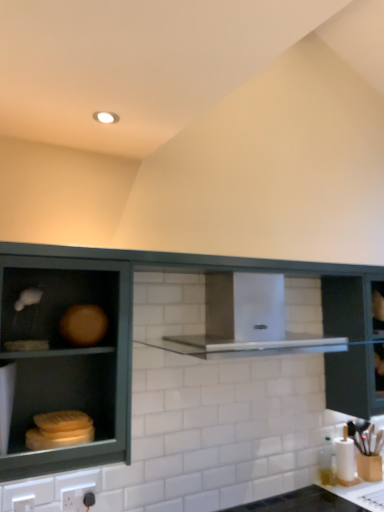
Question: Is transparent glass cabinet at right to the right of black plastic electric outlet at lower center, placed as the 1th electric outlet when sorted from back to front, from the viewer's perspective?

Choices:
 (A) no
 (B) yes

Answer: (B)

Question: Is transparent glass cabinet at right touching black plastic electric outlet at lower center, arranged as the 2th electric outlet when viewed from the left?

Choices:
 (A) no
 (B) yes

Answer: (A)

Question: Is transparent glass cabinet at right behind black plastic electric outlet at lower center, placed as the 1th electric outlet when sorted from back to front?

Choices:
 (A) yes
 (B) no

Answer: (A)

Question: Is black plastic electric outlet at lower center, arranged as the 2th electric outlet when viewed from the left, a part of transparent glass cabinet at right?

Choices:
 (A) no
 (B) yes

Answer: (A)

Question: Is transparent glass cabinet at right positioned far away from black plastic electric outlet at lower center, arranged as the 2th electric outlet when viewed from the left?

Choices:
 (A) yes
 (B) no

Answer: (A)

Question: Is point (309, 484) closer or farther from the camera than point (26, 397)?

Choices:
 (A) closer
 (B) farther

Answer: (B)

Question: In the image, is black glossy countertop at lower right positioned in front of or behind green matte cabinet at left, which ranks as the 1th cabinetry in back-to-front order?

Choices:
 (A) front
 (B) behind

Answer: (B)

Question: Looking at their shapes, would you say black glossy countertop at lower right is wider or thinner than green matte cabinet at left, which ranks as the 1th cabinetry in back-to-front order?

Choices:
 (A) wide
 (B) thin

Answer: (A)

Question: Is black glossy countertop at lower right taller or shorter than green matte cabinet at left, positioned as the second cabinetry in front-to-back order?

Choices:
 (A) short
 (B) tall

Answer: (A)

Question: In terms of width, does green matte cabinet at left, positioned as the second cabinetry in front-to-back order, look wider or thinner when compared to black glossy countertop at lower right?

Choices:
 (A) wide
 (B) thin

Answer: (B)

Question: Is green matte cabinet at left, positioned as the second cabinetry in front-to-back order, inside the boundaries of black glossy countertop at lower right, or outside?

Choices:
 (A) outside
 (B) inside

Answer: (A)

Question: From their relative heights in the image, would you say green matte cabinet at left, positioned as the second cabinetry in front-to-back order, is taller or shorter than black glossy countertop at lower right?

Choices:
 (A) tall
 (B) short

Answer: (A)

Question: Does point (276, 347) appear closer or farther from the camera than point (344, 506)?

Choices:
 (A) closer
 (B) farther

Answer: (A)

Question: Considering the positions of white plastic electric outlet at lower left, which is counted as the second electric outlet, starting from the right, and matte wood cabinet at left, which is the second cabinetry from back to front, in the image, is white plastic electric outlet at lower left, which is counted as the second electric outlet, starting from the right, bigger or smaller than matte wood cabinet at left, which is the second cabinetry from back to front,?

Choices:
 (A) small
 (B) big

Answer: (A)

Question: Is white plastic electric outlet at lower left, which is counted as the second electric outlet, starting from the right, inside or outside of matte wood cabinet at left, which is the second cabinetry from back to front?

Choices:
 (A) inside
 (B) outside

Answer: (B)